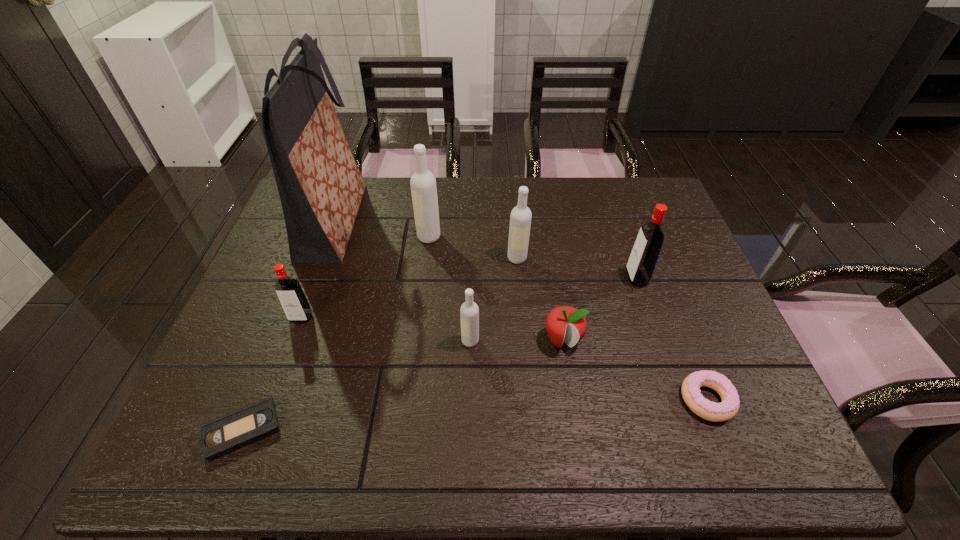
Identify the location of free spot located on the front and back of the rightmost vodka. The image size is (960, 540). (602, 278).

Locate an element on the screen. free space located on the front and back of the rightmost vodka is located at coordinates (558, 278).

Where is `vacant region located 0.050m on the front of the nearest white vodka`? vacant region located 0.050m on the front of the nearest white vodka is located at coordinates (469, 366).

Find the location of a particular element. vacant space situated on the front and back of the fifth farthest object is located at coordinates (263, 423).

I want to click on vacant space located on the back of the apple, so click(547, 242).

Where is `free space located on the left of the doughnut`? free space located on the left of the doughnut is located at coordinates (658, 400).

Locate an element on the screen. Image resolution: width=960 pixels, height=540 pixels. free space located on the right of the videotape is located at coordinates (348, 430).

The height and width of the screenshot is (540, 960). I want to click on object that is at the far edge, so click(x=320, y=186).

Locate an element on the screen. This screenshot has height=540, width=960. doughnut that is at the near edge is located at coordinates (729, 406).

This screenshot has height=540, width=960. Find the location of `videotape at the near edge`. videotape at the near edge is located at coordinates (230, 432).